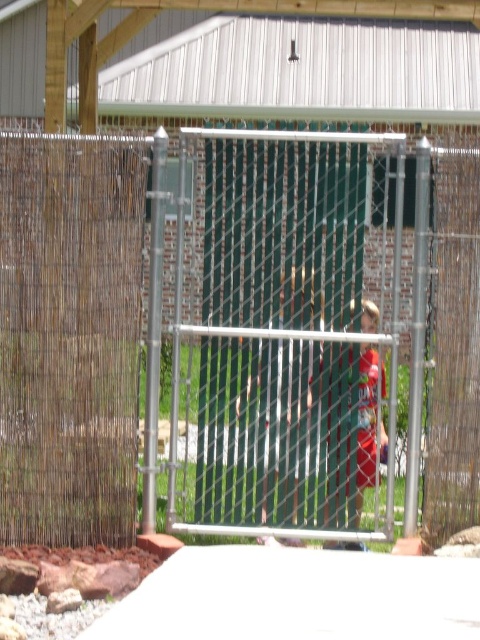
You are standing in front of the fenced area and want to know which of the two points, point [405,168] or point [365,372], is closer to you. Based on the scene, can you determine which point is nearer?

Point [405,168] is closer to the viewer than point [365,372].

You are standing in front of the fenced area and see the brown woven mat at left and the red cotton shirt at center. Which object is closer to the left side of the image?

The brown woven mat at left is closer to the left side of the image because it is positioned to the left of the red cotton shirt at center.

You are standing in front of the fenced area and want to place a small potted plant exactly at the center of the brown woven mat at left. Given that the center of the brown woven mat at left is located at point coordinates of (236, 330), can you confirm if this placement is feasible?

Yes, the placement is feasible because the center of the brown woven mat at left is exactly at point coordinates of (236, 330), so placing the potted plant there would be accurate.